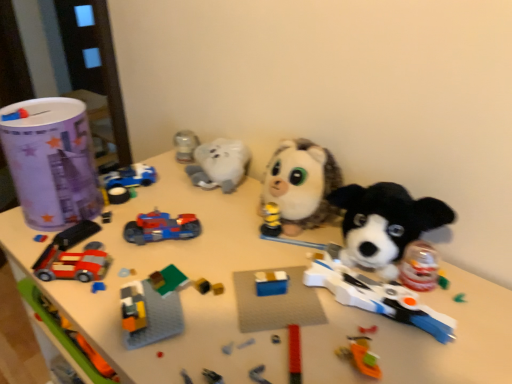
The image size is (512, 384). Identify the location of empty space that is ontop of white matte table at center (from a real-world perspective). (240, 264).